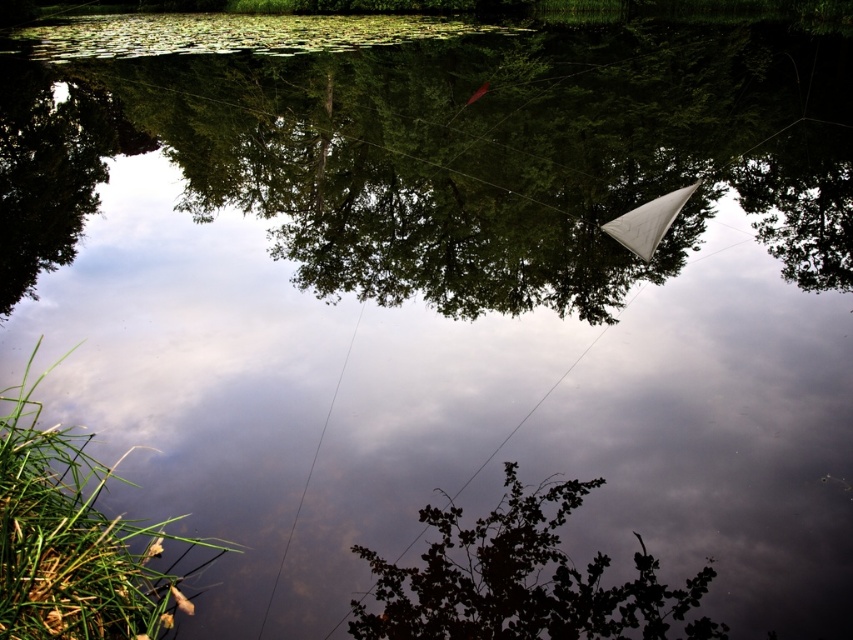
Between dark green leafy tree at center and white fabric kite at upper right, which one has less height?

Standing shorter between the two is dark green leafy tree at center.

Measure the distance between dark green leafy tree at center and white fabric kite at upper right.

They are 5.01 meters apart.

Does point (463, 616) come closer to viewer compared to point (641, 220)?

That is True.

Where is `dark green leafy tree at center`? The width and height of the screenshot is (853, 640). dark green leafy tree at center is located at coordinates 521,580.

Between white fabric kite at upper right and clear wire at center, which one appears on the left side from the viewer's perspective?

clear wire at center is more to the left.

Locate an element on the screen. Image resolution: width=853 pixels, height=640 pixels. white fabric kite at upper right is located at coordinates (648, 221).

The height and width of the screenshot is (640, 853). Find the location of `white fabric kite at upper right`. white fabric kite at upper right is located at coordinates (648, 221).

Does dark green leafy tree at center lie behind clear wire at center?

No, it is in front of clear wire at center.

Is point (697, 580) closer to camera compared to point (296, 506)?

Yes, point (697, 580) is closer to viewer.

Measure the distance between point (393,580) and camera.

Point (393,580) is 3.90 meters away from camera.

You are a GUI agent. You are given a task and a screenshot of the screen. Output one action in this format:
    pyautogui.click(x=<x>, y=<y>)
    Task: Click on the dark green leafy tree at center
    This screenshot has height=640, width=853.
    Given the screenshot: What is the action you would take?
    pyautogui.click(x=521, y=580)